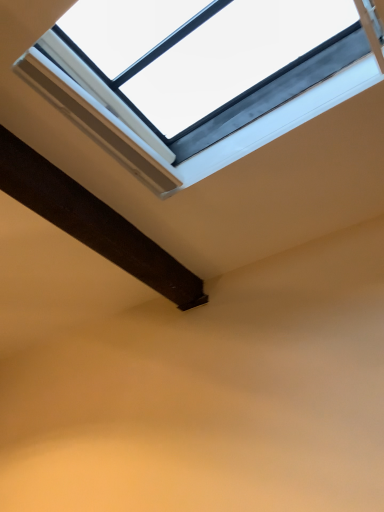
This screenshot has height=512, width=384. What do you see at coordinates (154, 138) in the screenshot?
I see `white plastic window at upper center` at bounding box center [154, 138].

In order to click on white plastic window at upper center in this screenshot , I will do `click(154, 138)`.

Locate an element on the screen. The image size is (384, 512). white plastic window at upper center is located at coordinates (154, 138).